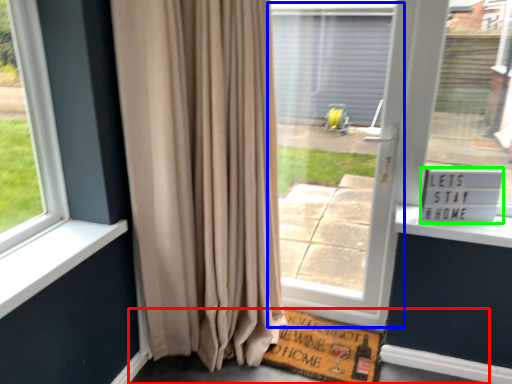
Question: Which object is positioned farthest from pavement (highlighted by a red box)? Select from screen door (highlighted by a blue box) and plaque (highlighted by a green box).

Choices:
 (A) screen door
 (B) plaque

Answer: (B)